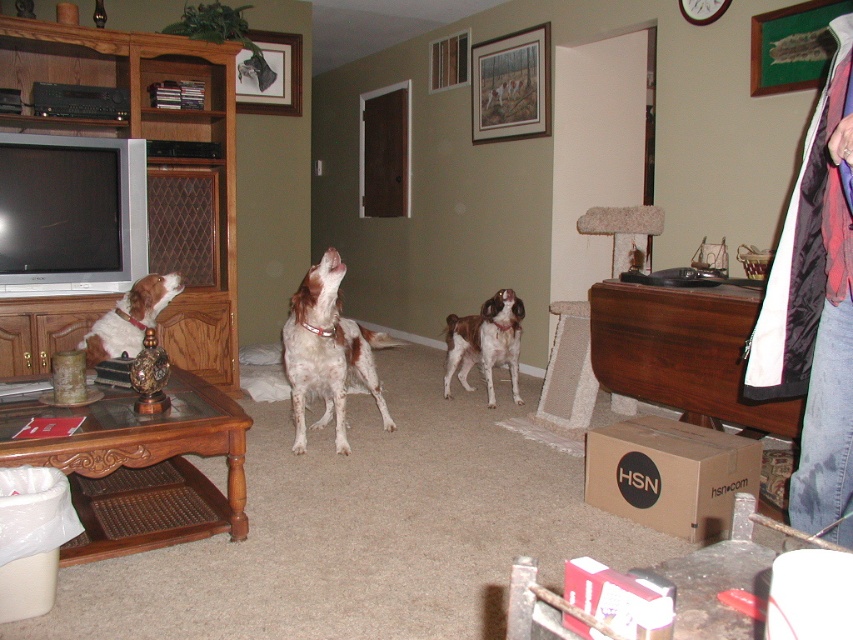
Question: Does denim jacket at lower right appear on the left side of brown speckled fur at center?

Choices:
 (A) yes
 (B) no

Answer: (B)

Question: Which of the following is the closest to the observer?

Choices:
 (A) denim jacket at lower right
 (B) brown speckled fur dog at center

Answer: (A)

Question: Is brown speckled fur dog at center to the left of brown speckled fur at left from the viewer's perspective?

Choices:
 (A) no
 (B) yes

Answer: (A)

Question: Can you confirm if wooden entertainment center at left is smaller than brown speckled fur at center?

Choices:
 (A) no
 (B) yes

Answer: (A)

Question: Which point is farther to the camera?

Choices:
 (A) brown speckled fur at center
 (B) denim jacket at lower right
 (C) brown speckled fur at left
 (D) wooden entertainment center at left

Answer: (D)

Question: Which object appears closest to the camera in this image?

Choices:
 (A) brown speckled fur at center
 (B) brown speckled fur dog at center
 (C) wooden entertainment center at left
 (D) denim jacket at lower right

Answer: (D)